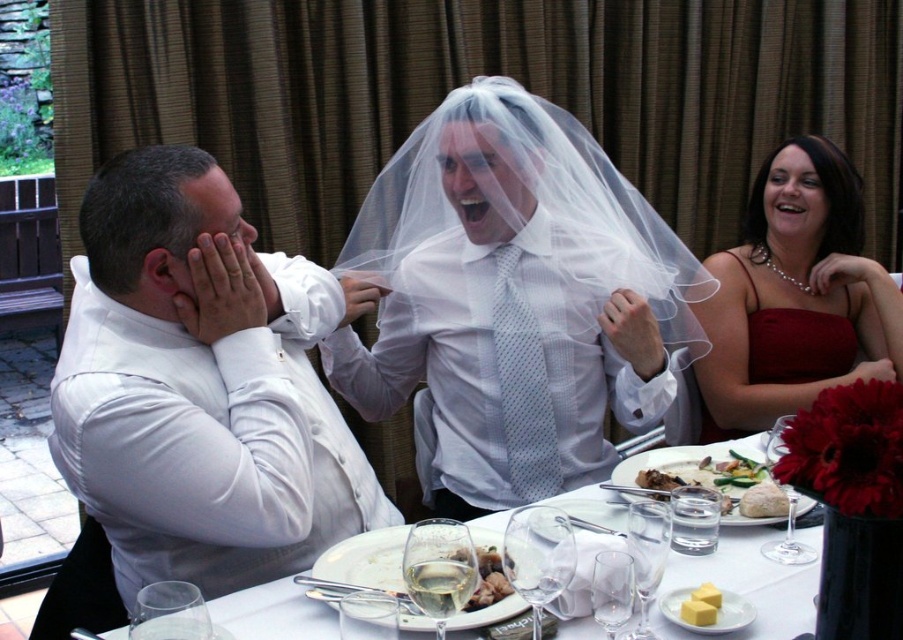
You are standing at the point labeled point [580,408]. You want to walk to the exit located at point [731,582]. Is there a clear path between these two points?

Point [580,408] is behind point [731,582], so there is a clear path between them.

You are a guest at the wedding reception and want to take a photo of the white glossy plate at center without the translucent white veil at center blocking it. How can you adjust your position to achieve this?

The white glossy plate at center is behind the translucent white veil at center. To take a photo of the white glossy plate at center without the veil blocking it, you can move to a position where the plate is visible behind the veil, perhaps by angling your camera around the veil or moving closer to see past it.

Consider the image. You are a photographer at the wedding reception and want to capture a photo where both the translucent white veil at center and the golden brown bread at center are visible. Since the veil is taller, will it block the bread from view? Please explain.

The translucent white veil at center is taller than the golden brown bread at center, but since the veil is translucent, it may allow some visibility of the bread behind it. However, the veil could partially obscure the bread depending on its opacity and positioning.